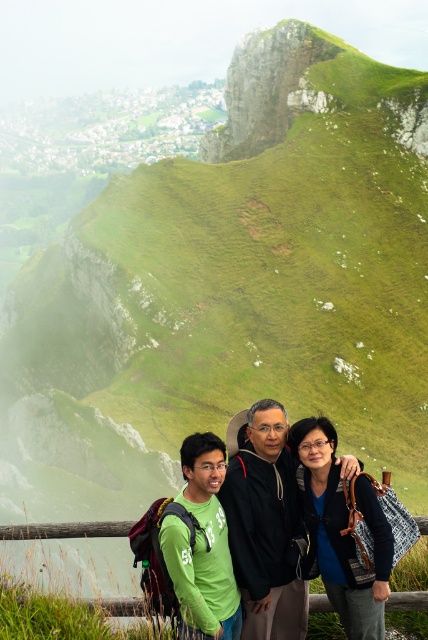
Question: Is green matte shirt at lower center positioned in front of matte black jacket at center?

Choices:
 (A) no
 (B) yes

Answer: (B)

Question: Is green matte shirt at lower center to the right of green matte shirt at lower left from the viewer's perspective?

Choices:
 (A) no
 (B) yes

Answer: (B)

Question: Which object is the farthest from the matte black jacket at center?

Choices:
 (A) green matte shirt at lower center
 (B) green matte shirt at lower left

Answer: (B)

Question: Which of the following is the farthest from the observer?

Choices:
 (A) (178, 588)
 (B) (312, 529)

Answer: (B)

Question: Is matte black jacket at center above green matte shirt at lower left?

Choices:
 (A) no
 (B) yes

Answer: (B)

Question: Which object appears farthest from the camera in this image?

Choices:
 (A) green matte shirt at lower left
 (B) matte black jacket at center
 (C) green matte shirt at lower center

Answer: (A)